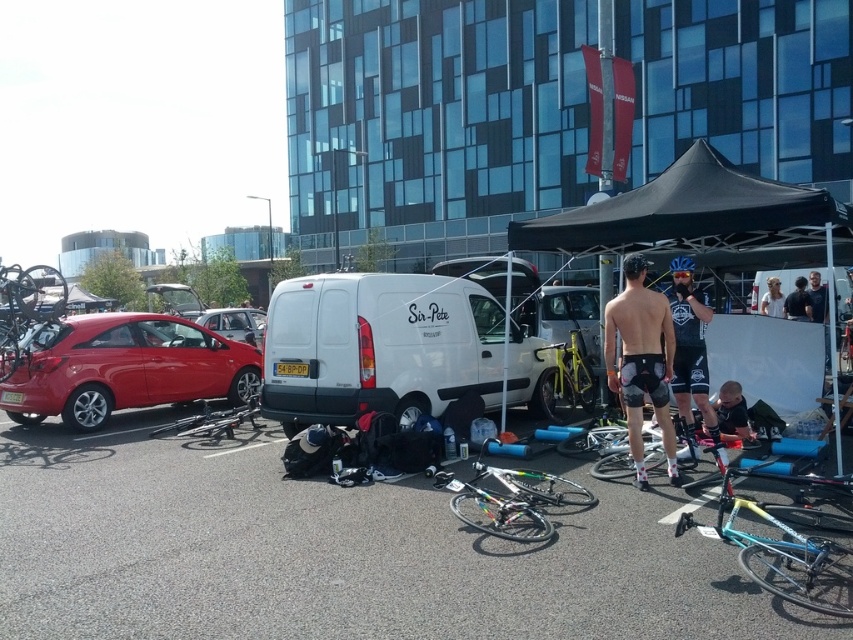
In the scene shown: You are a cyclist at the event and need to retrieve your shiny black bicycle at center. The white matte van at center is blocking your path. Can you move around the van to reach your bike?

The white matte van at center is located above the shiny black bicycle at center, meaning the van is positioned higher up in the frame. Since the van is blocking the path, you would need to move around it either to the left or right side to access the bicycle.

What object is located at the coordinates point (378, 348)?

The white matte van at center is located at point (378, 348).